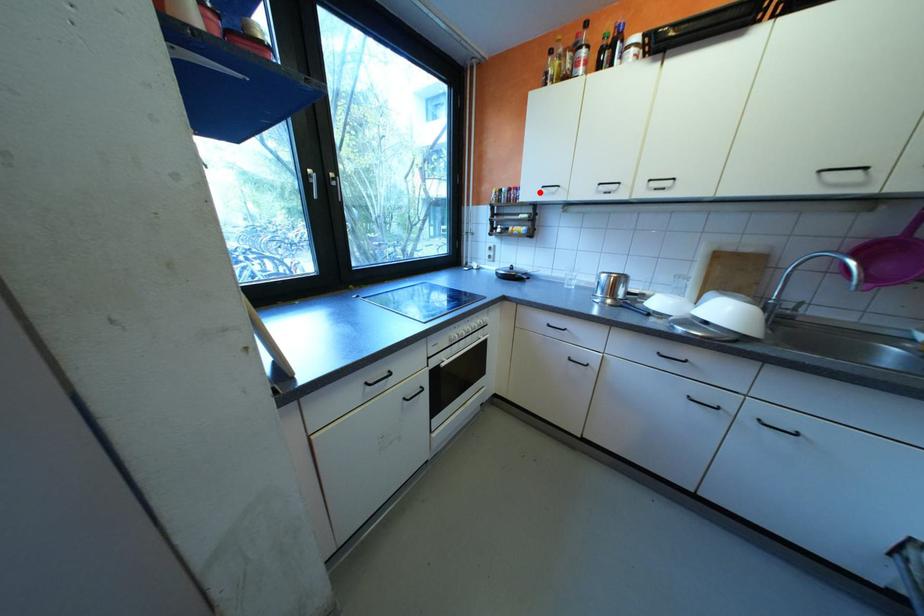
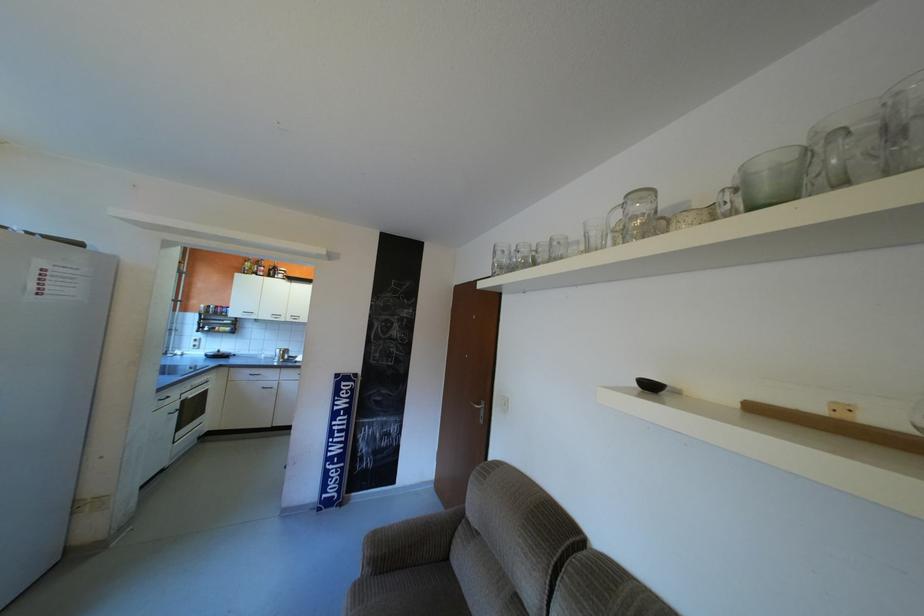
Where in the second image is the point corresponding to the highlighted location from the first image?

(246, 312)